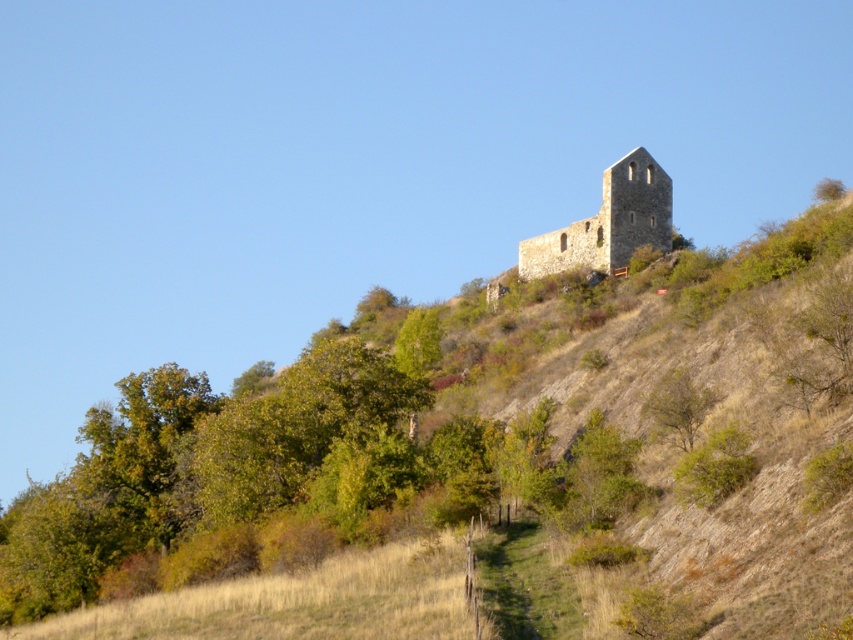
Question: Which point is farther from the camera taking this photo?

Choices:
 (A) (438, 452)
 (B) (552, 262)
 (C) (651, 394)

Answer: (B)

Question: From the image, what is the correct spatial relationship of brown stone ruins at upper center in relation to stone tower at upper right?

Choices:
 (A) below
 (B) above

Answer: (A)

Question: In this image, where is stone tower at upper right located relative to green leafy tree at center-right?

Choices:
 (A) below
 (B) above

Answer: (B)

Question: Can you confirm if stone tower at upper right is wider than green leafy tree at center-right?

Choices:
 (A) no
 (B) yes

Answer: (B)

Question: Which point appears farthest from the camera in this image?

Choices:
 (A) [259, 426]
 (B) [654, 413]

Answer: (A)

Question: Among these objects, which one is farthest from the camera?

Choices:
 (A) stone tower at upper right
 (B) brown stone ruins at upper center

Answer: (A)